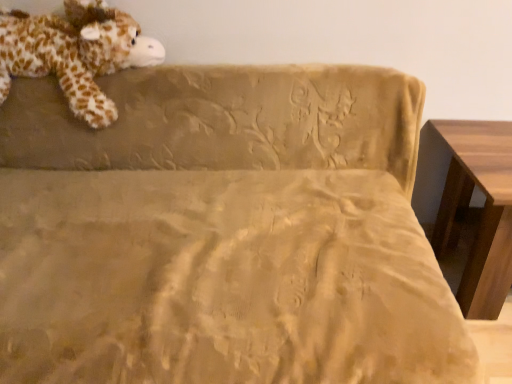
Question: In the image, is soft plush giraffe at upper left positioned in front of or behind wooden table at right?

Choices:
 (A) behind
 (B) front

Answer: (A)

Question: Which is correct: soft plush giraffe at upper left is inside wooden table at right, or outside of it?

Choices:
 (A) outside
 (B) inside

Answer: (A)

Question: Considering the positions of point (60, 39) and point (510, 225), is point (60, 39) closer or farther from the camera than point (510, 225)?

Choices:
 (A) farther
 (B) closer

Answer: (A)

Question: Is point (474, 177) positioned closer to the camera than point (26, 54)?

Choices:
 (A) farther
 (B) closer

Answer: (B)

Question: Is wooden table at right in front of or behind soft plush giraffe at upper left in the image?

Choices:
 (A) behind
 (B) front

Answer: (B)

Question: Considering the positions of wooden table at right and soft plush giraffe at upper left in the image, is wooden table at right bigger or smaller than soft plush giraffe at upper left?

Choices:
 (A) big
 (B) small

Answer: (A)

Question: Do you think wooden table at right is within soft plush giraffe at upper left, or outside of it?

Choices:
 (A) inside
 (B) outside

Answer: (B)